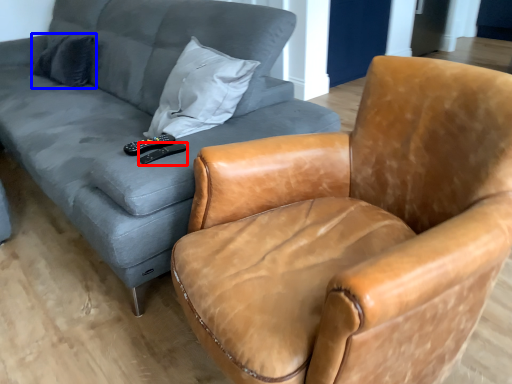
Question: Which of the following is the farthest to the observer, remote (highlighted by a red box) or pillow (highlighted by a blue box)?

Choices:
 (A) remote
 (B) pillow

Answer: (B)